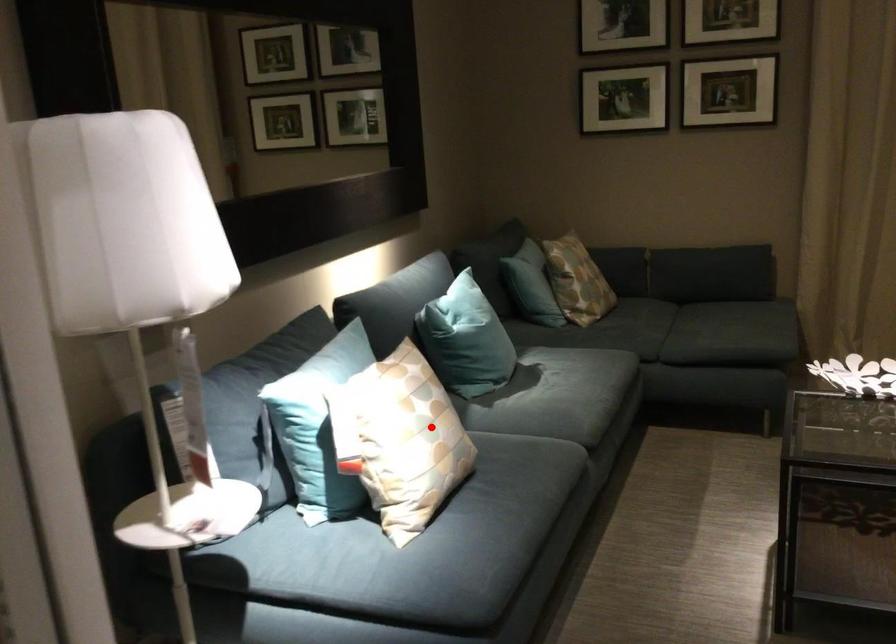
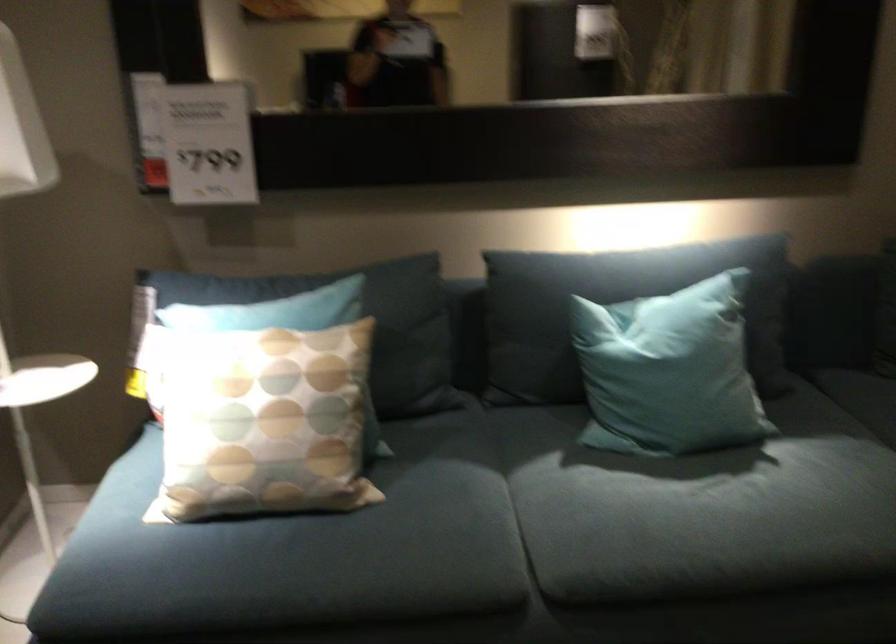
Question: I am providing you with two images of the same scene from different viewpoints. Given a red point in image1, look at the same physical point in image2. Is it:

Choices:
 (A) Closer to the viewpoint
 (B) Farther from the viewpoint

Answer: (A)